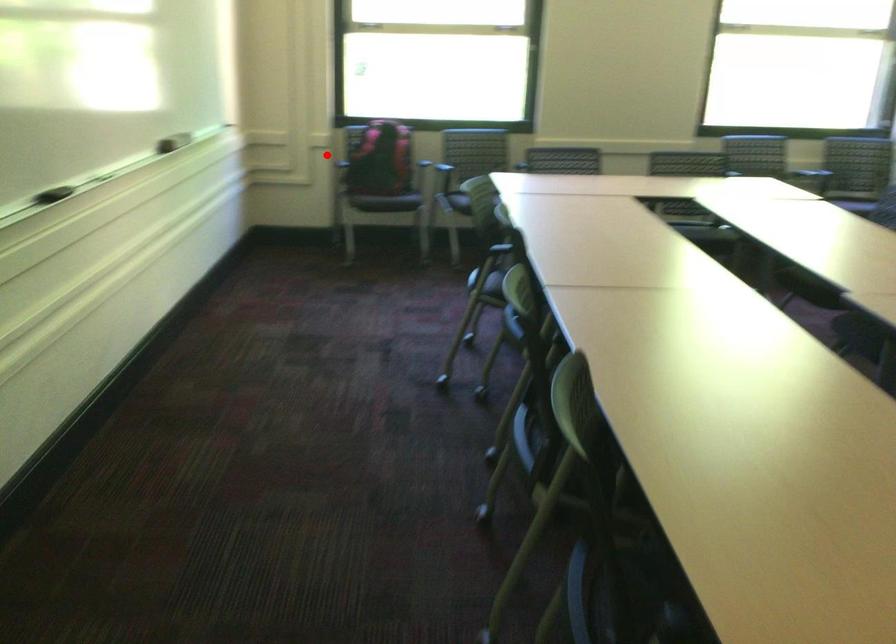
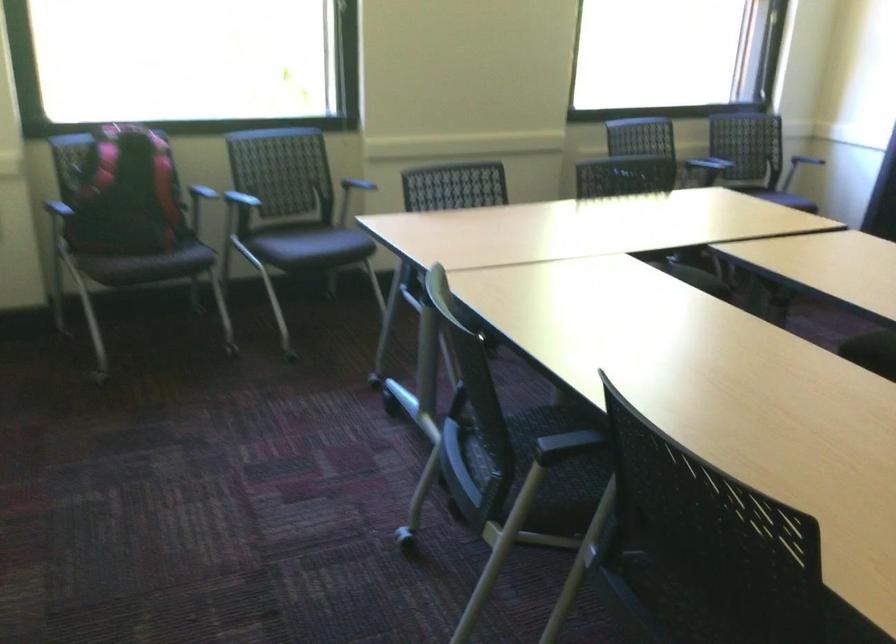
Question: I am providing you with two images of the same scene from different viewpoints. In image1, a red point is highlighted. Considering the same 3D point in image2, which of the following is correct?

Choices:
 (A) It is closer
 (B) It is farther

Answer: (A)